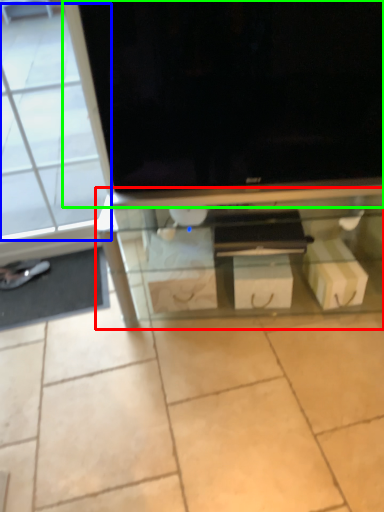
Question: Estimate the real-world distances between objects in this image. Which object is closer to shelf (highlighted by a red box), glass door (highlighted by a blue box) or television (highlighted by a green box)?

Choices:
 (A) glass door
 (B) television

Answer: (B)